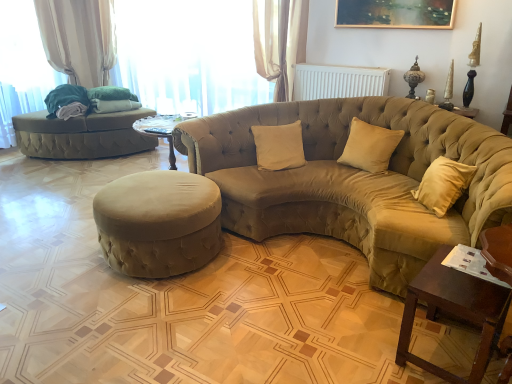
Question: Considering the relative sizes of suede beige pillow at center, placed as the 1th pillow when sorted from right to left, and velvet beige studio couch at center, which is the 1th studio couch in front-to-back order, in the image provided, is suede beige pillow at center, placed as the 1th pillow when sorted from right to left, smaller than velvet beige studio couch at center, which is the 1th studio couch in front-to-back order,?

Choices:
 (A) yes
 (B) no

Answer: (A)

Question: Are suede beige pillow at center, placed as the 1th pillow when sorted from right to left, and velvet beige studio couch at center, which is the 2th studio couch in back-to-front order, making contact?

Choices:
 (A) yes
 (B) no

Answer: (B)

Question: Is suede beige pillow at center, placed as the 1th pillow when sorted from right to left, closer to the viewer compared to velvet beige studio couch at center, the 2th studio couch in the left-to-right sequence?

Choices:
 (A) no
 (B) yes

Answer: (A)

Question: Is suede beige pillow at center, placed as the 1th pillow when sorted from right to left, turned away from velvet beige studio couch at center, the 2th studio couch in the left-to-right sequence?

Choices:
 (A) no
 (B) yes

Answer: (B)

Question: From a real-world perspective, does suede beige pillow at center, placed as the 1th pillow when sorted from right to left, stand above velvet beige studio couch at center, which is the 1th studio couch in front-to-back order?

Choices:
 (A) yes
 (B) no

Answer: (A)

Question: Considering the positions of point (317, 77) and point (224, 69), is point (317, 77) closer or farther from the camera than point (224, 69)?

Choices:
 (A) farther
 (B) closer

Answer: (B)

Question: Is white plastic radiator at upper center inside the boundaries of sheer fabric curtain at upper center, or outside?

Choices:
 (A) inside
 (B) outside

Answer: (B)

Question: Is white plastic radiator at upper center in front of or behind sheer fabric curtain at upper center in the image?

Choices:
 (A) front
 (B) behind

Answer: (A)

Question: Looking at their shapes, would you say white plastic radiator at upper center is wider or thinner than sheer fabric curtain at upper center?

Choices:
 (A) wide
 (B) thin

Answer: (B)

Question: Is sheer fabric curtain at upper center bigger or smaller than white plastic radiator at upper center?

Choices:
 (A) big
 (B) small

Answer: (A)

Question: From a real-world perspective, is sheer fabric curtain at upper center physically located above or below white plastic radiator at upper center?

Choices:
 (A) below
 (B) above

Answer: (A)

Question: Considering the positions of sheer fabric curtain at upper center and white plastic radiator at upper center in the image, is sheer fabric curtain at upper center taller or shorter than white plastic radiator at upper center?

Choices:
 (A) short
 (B) tall

Answer: (B)

Question: Is sheer fabric curtain at upper center wider or thinner than white plastic radiator at upper center?

Choices:
 (A) thin
 (B) wide

Answer: (B)

Question: Is velvet beige studio couch at center, the 2th studio couch in the left-to-right sequence, in front of or behind wooden table at lower right in the image?

Choices:
 (A) behind
 (B) front

Answer: (A)

Question: In terms of width, does velvet beige studio couch at center, which is the 1th studio couch in front-to-back order, look wider or thinner when compared to wooden table at lower right?

Choices:
 (A) wide
 (B) thin

Answer: (A)